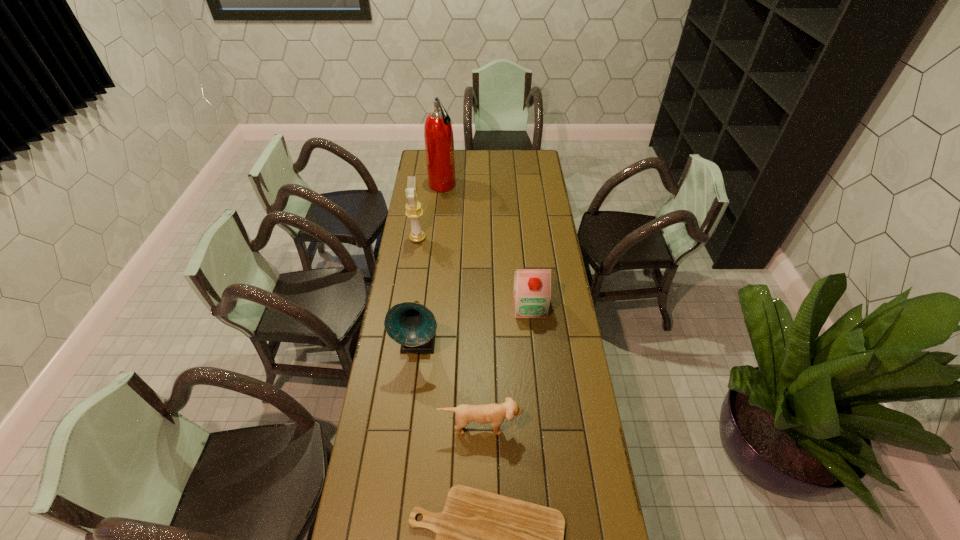
Where is `free spot located 0.120m from the horn of the fourth farthest object`? This screenshot has height=540, width=960. free spot located 0.120m from the horn of the fourth farthest object is located at coordinates (412, 393).

Locate an element on the screen. The height and width of the screenshot is (540, 960). vacant space located with the cap open on the third farthest object is located at coordinates (534, 347).

Identify the location of vacant space situated 0.310m on the left side of the second nearest object. (480, 539).

Image resolution: width=960 pixels, height=540 pixels. Identify the location of fire extinguisher situated at the left edge. (438, 134).

You are a GUI agent. You are given a task and a screenshot of the screen. Output one action in this format:
    pyautogui.click(x=<x>, y=<y>)
    Task: Click on the award that is at the left edge
    
    Given the screenshot: What is the action you would take?
    pyautogui.click(x=414, y=211)

Where is `phonograph_record present at the left edge`? phonograph_record present at the left edge is located at coordinates (411, 324).

Locate an element on the screen. The height and width of the screenshot is (540, 960). object that is at the right edge is located at coordinates (532, 287).

Find the location of a particular element. Image resolution: width=960 pixels, height=540 pixels. free region at the far edge of the desktop is located at coordinates (483, 161).

At what (x,y) coordinates should I click in order to perform the action: click on free spot at the left edge of the desktop. Please return your answer as a coordinate pair (x, y). This screenshot has width=960, height=540. Looking at the image, I should click on (420, 201).

In the image, there is a desktop. Identify the location of vacant space at the right edge. (567, 479).